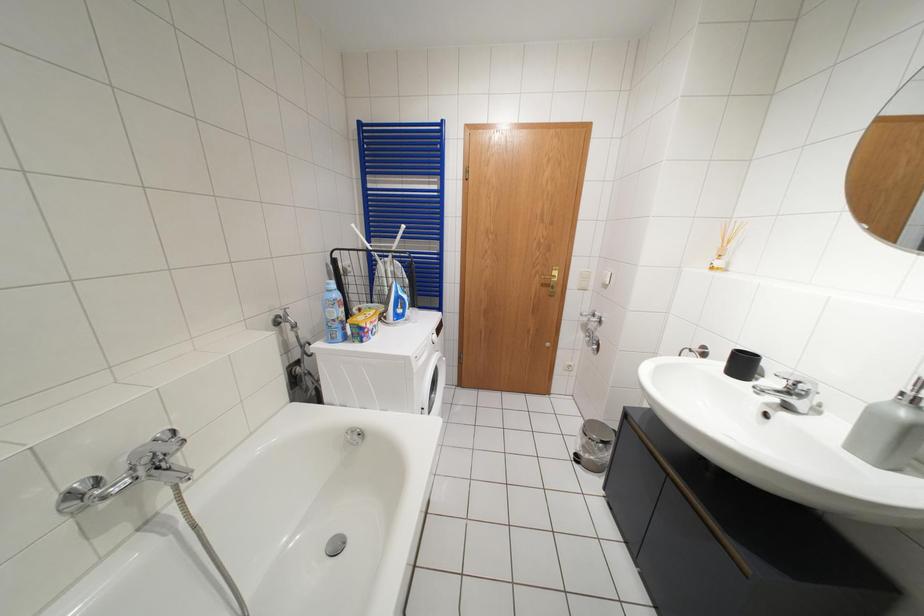
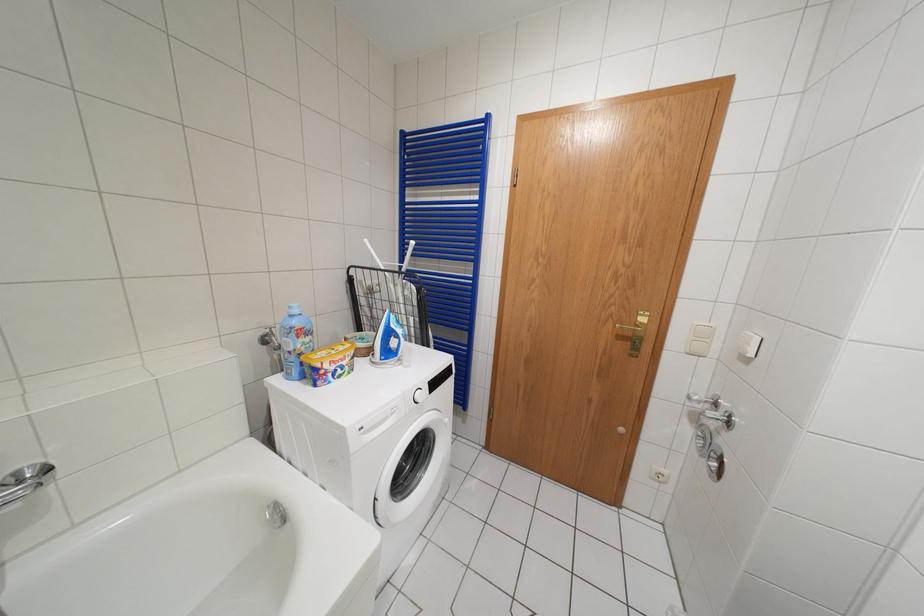
Question: The camera is either moving clockwise (left) or counter-clockwise (right) around the object. The first image is from the beginning of the video and the second image is from the end. Is the camera moving left or right when shooting the video?

Choices:
 (A) Left
 (B) Right

Answer: (B)